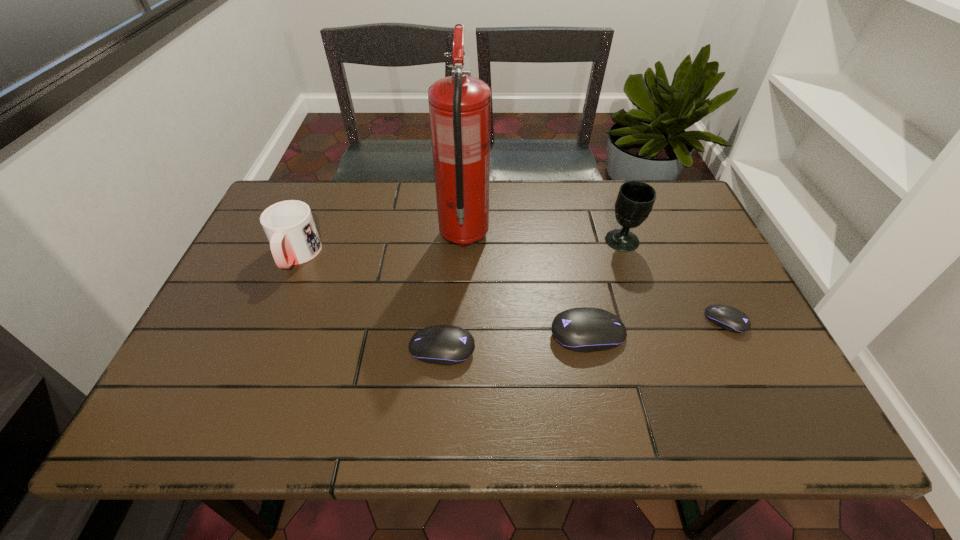
Identify the location of empty space between the fire extinguisher and the rightmost object. This screenshot has width=960, height=540. (595, 279).

I want to click on vacant space in between the second object from right to left and the leftmost computer mouse, so click(532, 295).

Where is `empty location between the second computer mouse from right to left and the fifth shortest object`? The image size is (960, 540). empty location between the second computer mouse from right to left and the fifth shortest object is located at coordinates (605, 288).

Find the location of `unoccupied area between the third object from right to left and the shortest object`. unoccupied area between the third object from right to left and the shortest object is located at coordinates (657, 328).

Select which object appears as the closest to the mug. Please provide its 2D coordinates. Your answer should be formatted as a tuple, i.e. [(x, y)], where the tuple contains the x and y coordinates of a point satisfying the conditions above.

[(459, 105)]

Locate an element on the screen. The width and height of the screenshot is (960, 540). object that is the fifth closest one to the rightmost computer mouse is located at coordinates (289, 226).

Identify which computer mouse is the third closest to the fire extinguisher. Please provide its 2D coordinates. Your answer should be formatted as a tuple, i.e. [(x, y)], where the tuple contains the x and y coordinates of a point satisfying the conditions above.

[(731, 319)]

Identify the location of computer mouse that stands as the closest to the tallest object. (584, 329).

You are a GUI agent. You are given a task and a screenshot of the screen. Output one action in this format:
    pyautogui.click(x=<x>, y=<y>)
    Task: Click on the vacant point that satisfies the following two spatial constraints: 1. on the side of the third tallest object with the handle; 2. on the right side of the second shortest object
    
    Given the screenshot: What is the action you would take?
    [256, 349]

Locate an element on the screen. vacant position in the image that satisfies the following two spatial constraints: 1. on the front side of the rightmost computer mouse; 2. on the left side of the fifth shortest object is located at coordinates (649, 321).